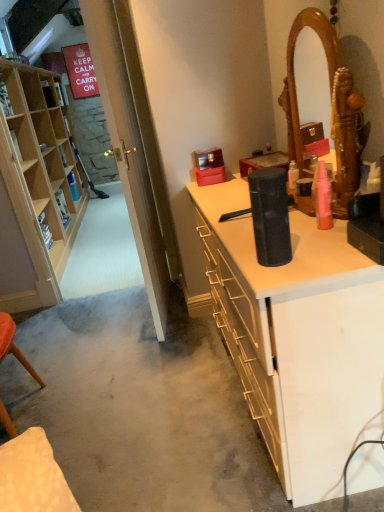
Where is `free point to the right of black matte speaker at center`? free point to the right of black matte speaker at center is located at coordinates (322, 252).